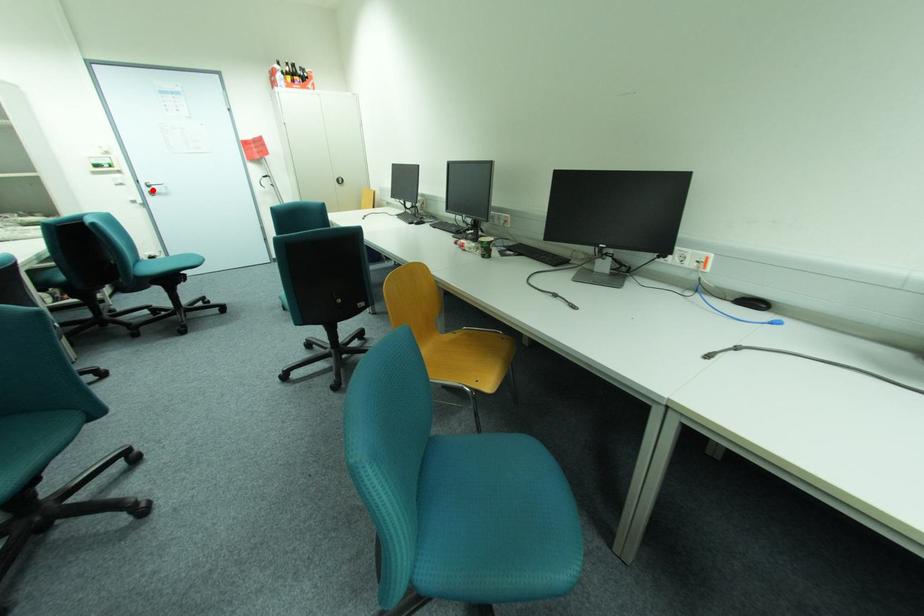
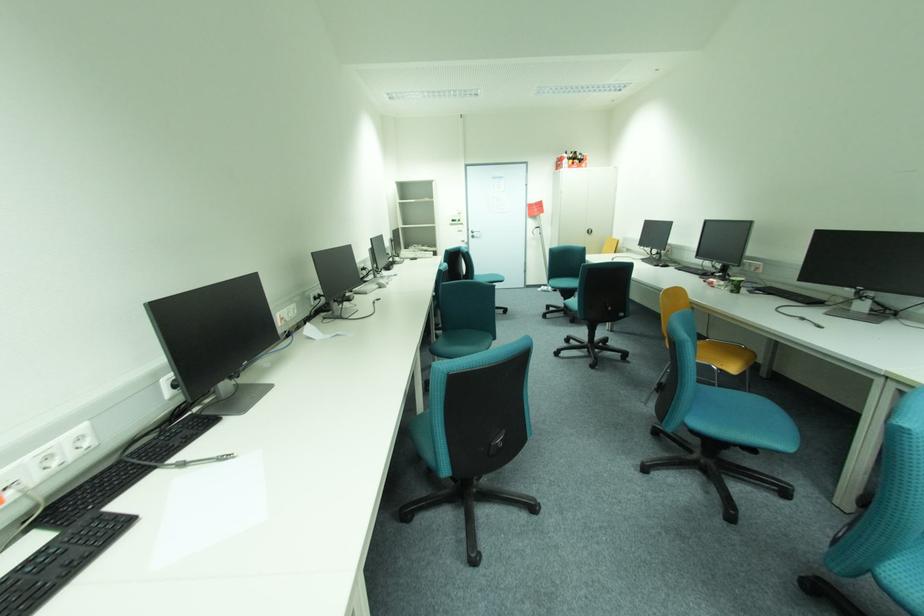
Find the pixel in the second image that matches the highlighted location in the first image.

(477, 235)